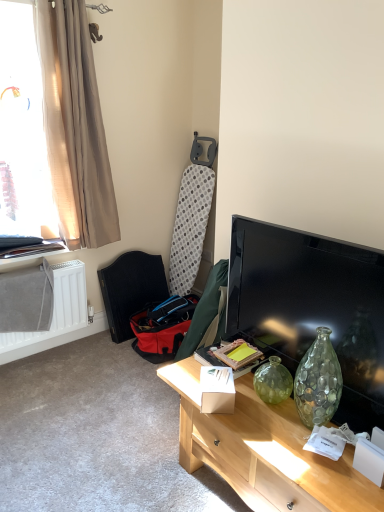
Identify the location of free space above white cardboard box at center (from a real-world perspective). This screenshot has height=512, width=384. (224, 373).